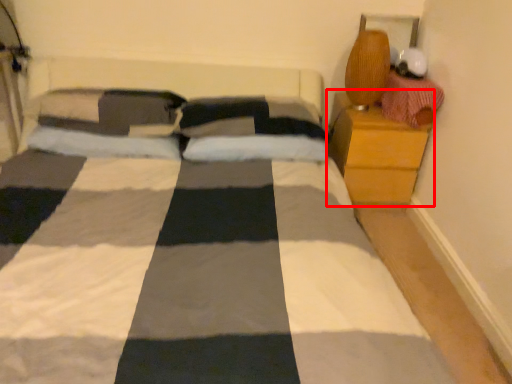
Question: In this image, where is nightstand (annotated by the red box) located relative to material?

Choices:
 (A) right
 (B) left

Answer: (B)